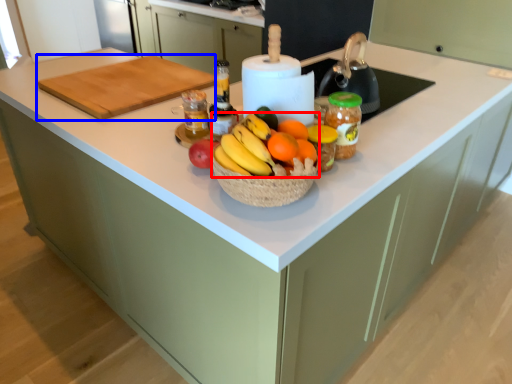
Question: Which object is further to the camera taking this photo, grapefruit (highlighted by a red box) or cutting board (highlighted by a blue box)?

Choices:
 (A) grapefruit
 (B) cutting board

Answer: (B)